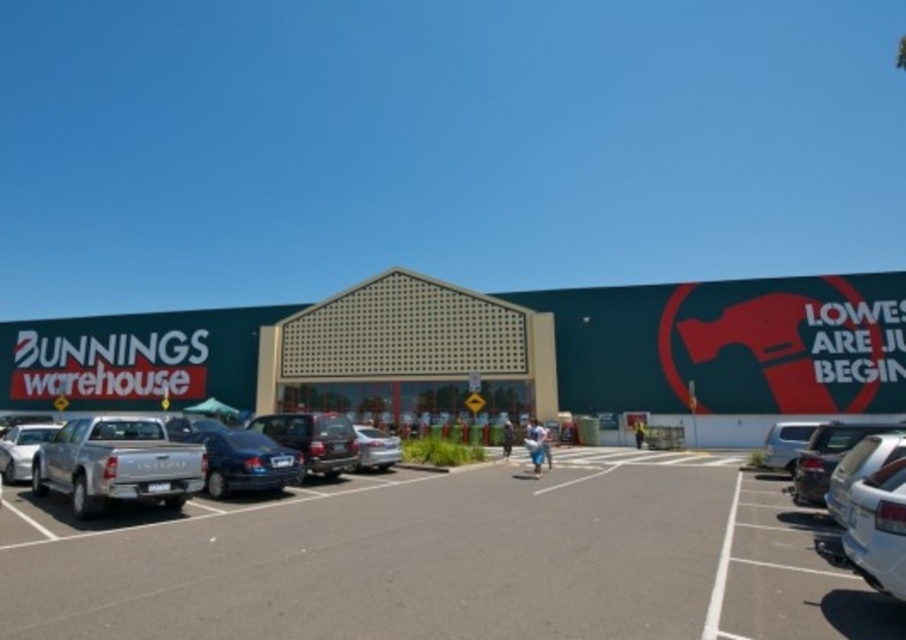
Does silver metallic pickup truck at lower left lie behind satin silver sedan at center?

That is False.

The width and height of the screenshot is (906, 640). Find the location of `silver metallic pickup truck at lower left`. silver metallic pickup truck at lower left is located at coordinates (117, 464).

Does silver metallic pickup truck at lower left come in front of silver metallic truck at left?

Yes, silver metallic pickup truck at lower left is closer to the viewer.

What do you see at coordinates (117, 464) in the screenshot?
I see `silver metallic pickup truck at lower left` at bounding box center [117, 464].

Identify the location of silver metallic pickup truck at lower left. (117, 464).

Does asphalt at center have a larger size compared to white matte car at lower right?

Correct, asphalt at center is larger in size than white matte car at lower right.

In the scene shown: Who is more distant from viewer, (590, 620) or (901, 588)?

The point (590, 620) is more distant.

Image resolution: width=906 pixels, height=640 pixels. What do you see at coordinates (448, 561) in the screenshot?
I see `asphalt at center` at bounding box center [448, 561].

The image size is (906, 640). I want to click on asphalt at center, so click(x=448, y=561).